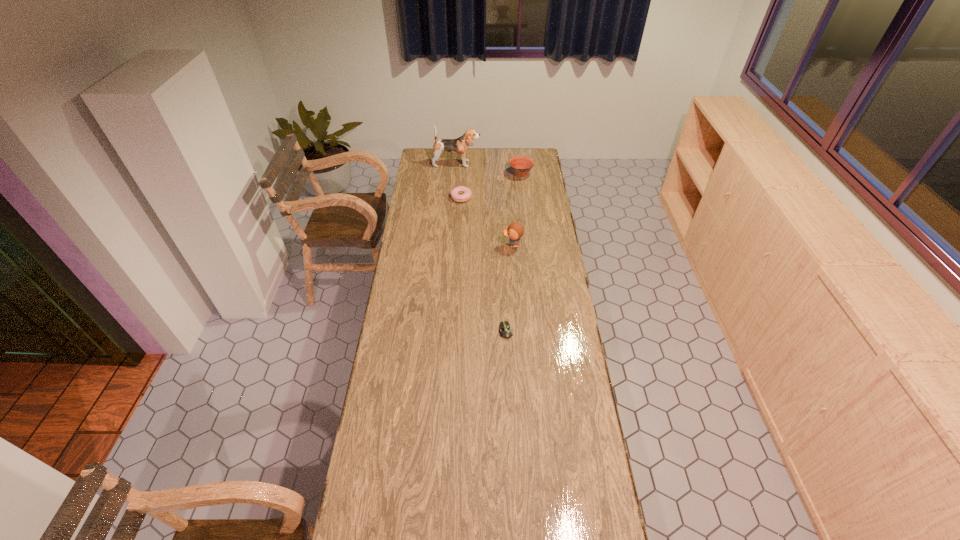
Where is `free space located 0.090m on the front-facing side of the duck`? Image resolution: width=960 pixels, height=540 pixels. free space located 0.090m on the front-facing side of the duck is located at coordinates (483, 245).

Where is `free space located on the front-facing side of the duck`? The width and height of the screenshot is (960, 540). free space located on the front-facing side of the duck is located at coordinates (483, 245).

This screenshot has width=960, height=540. Identify the location of free location located on the front of the bowl. (523, 191).

Where is `free space located 0.070m on the right of the second shortest object`? The height and width of the screenshot is (540, 960). free space located 0.070m on the right of the second shortest object is located at coordinates (485, 197).

Where is `vacant space situated 0.120m on the front of the shortest object`? vacant space situated 0.120m on the front of the shortest object is located at coordinates (508, 364).

Locate an element on the screen. puppy positioned at the far edge is located at coordinates (460, 145).

At what (x,y) coordinates should I click in order to perform the action: click on bowl located in the far edge section of the desktop. Please return your answer as a coordinate pair (x, y). This screenshot has height=540, width=960. Looking at the image, I should click on (521, 165).

Identify the location of object located at the left edge. Image resolution: width=960 pixels, height=540 pixels. (460, 145).

This screenshot has width=960, height=540. I want to click on object that is at the right edge, so click(x=521, y=165).

Locate an element on the screen. object present at the far left corner is located at coordinates (460, 145).